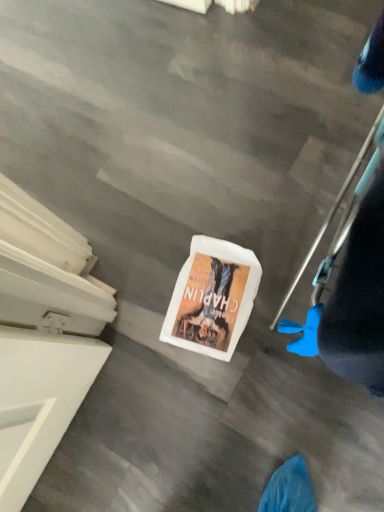
You are a GUI agent. You are given a task and a screenshot of the screen. Output one action in this format:
    pyautogui.click(x=<x>, y=<y>)
    Task: Click on the free space to the left of white matte book at center
    
    Given the screenshot: What is the action you would take?
    point(140,314)